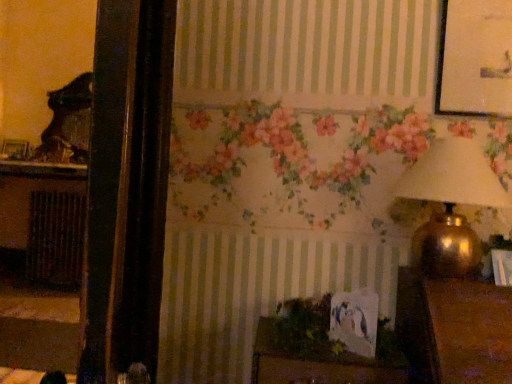
Question: From the image's perspective, is brown textured radiator at left above green leafy plant at center?

Choices:
 (A) no
 (B) yes

Answer: (A)

Question: Is brown textured radiator at left positioned before green leafy plant at center?

Choices:
 (A) no
 (B) yes

Answer: (A)

Question: From a real-world perspective, is brown textured radiator at left under green leafy plant at center?

Choices:
 (A) yes
 (B) no

Answer: (A)

Question: Can you confirm if brown textured radiator at left is wider than green leafy plant at center?

Choices:
 (A) no
 (B) yes

Answer: (B)

Question: From a real-world perspective, is brown textured radiator at left over green leafy plant at center?

Choices:
 (A) no
 (B) yes

Answer: (A)

Question: Looking at their shapes, would you say wooden picture frame at left is wider or thinner than green leafy plant at center?

Choices:
 (A) wide
 (B) thin

Answer: (B)

Question: From the image's perspective, is wooden picture frame at left located above or below green leafy plant at center?

Choices:
 (A) above
 (B) below

Answer: (A)

Question: Considering the positions of wooden picture frame at left and green leafy plant at center in the image, is wooden picture frame at left taller or shorter than green leafy plant at center?

Choices:
 (A) short
 (B) tall

Answer: (B)

Question: Considering their positions, is wooden picture frame at left located in front of or behind green leafy plant at center?

Choices:
 (A) front
 (B) behind

Answer: (B)

Question: Considering their positions, is brown textured radiator at left located in front of or behind gold metallic lampshade at upper right?

Choices:
 (A) front
 (B) behind

Answer: (B)

Question: From the image's perspective, relative to gold metallic lampshade at upper right, is brown textured radiator at left above or below?

Choices:
 (A) above
 (B) below

Answer: (B)

Question: From their relative heights in the image, would you say brown textured radiator at left is taller or shorter than gold metallic lampshade at upper right?

Choices:
 (A) short
 (B) tall

Answer: (B)

Question: Considering the positions of brown textured radiator at left and gold metallic lampshade at upper right in the image, is brown textured radiator at left wider or thinner than gold metallic lampshade at upper right?

Choices:
 (A) thin
 (B) wide

Answer: (A)

Question: Is point (36, 241) closer or farther from the camera than point (8, 155)?

Choices:
 (A) closer
 (B) farther

Answer: (A)

Question: From a real-world perspective, is brown textured radiator at left above or below wooden picture frame at left?

Choices:
 (A) above
 (B) below

Answer: (B)